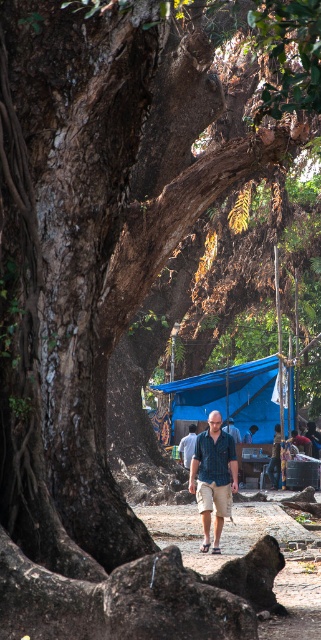
Question: Can you confirm if blue tarpaulin at center is wider than blue fabric at center?

Choices:
 (A) no
 (B) yes

Answer: (B)

Question: Which object appears closest to the camera in this image?

Choices:
 (A) blue shirt at center
 (B) blue tarpaulin at center
 (C) blue fabric at center

Answer: (C)

Question: Among these points, which one is farthest from the camera?

Choices:
 (A) (199, 508)
 (B) (236, 435)

Answer: (B)

Question: Which object is closer to the camera taking this photo?

Choices:
 (A) blue fabric at center
 (B) blue tarpaulin at center
 (C) blue shirt at center

Answer: (A)

Question: In this image, where is dirt path at center located relative to blue tarpaulin at center?

Choices:
 (A) left
 (B) right

Answer: (A)

Question: From the image, what is the correct spatial relationship of dirt path at center in relation to blue textured shirt at center?

Choices:
 (A) below
 (B) above

Answer: (A)